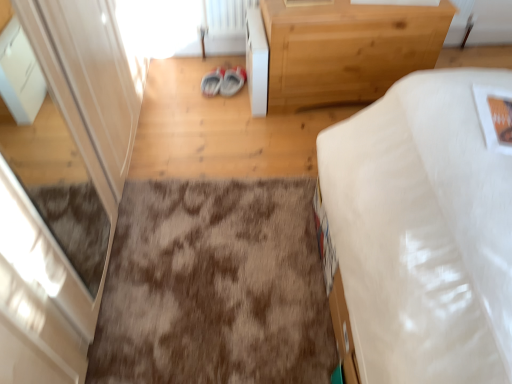
Locate an element on the screen. This screenshot has height=384, width=512. free spot below brown shaggy rug at center (from a real-world perspective) is located at coordinates (213, 286).